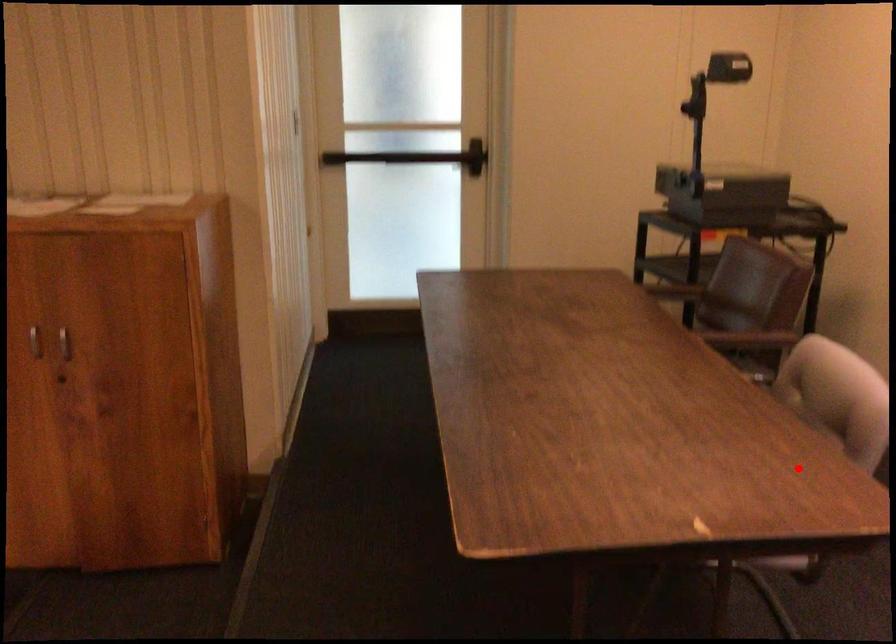
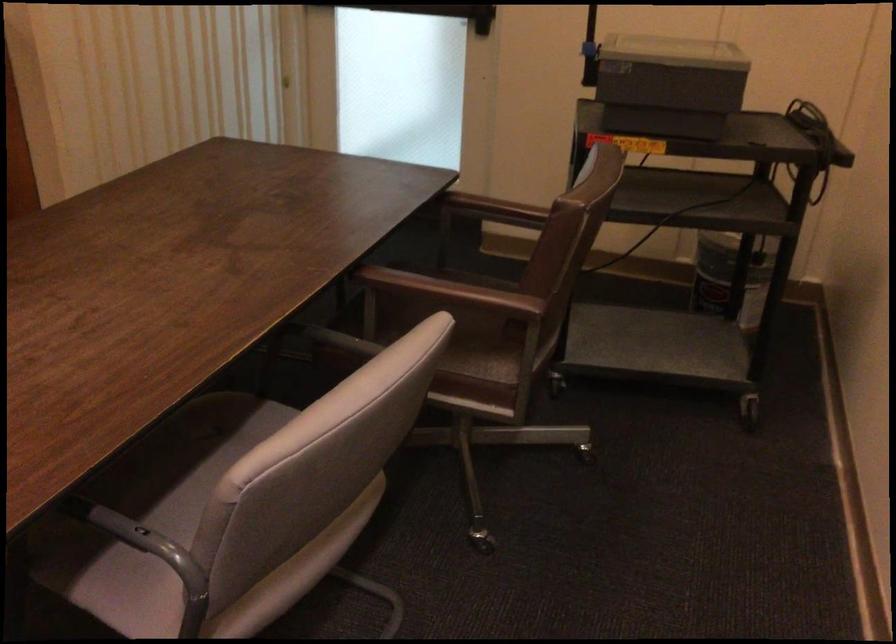
Question: I am providing you with two images of the same scene from different viewpoints. Image1 has a red point marked. In image2, the corresponding 3D location appears at what relative position? Reply with the corresponding letter.

Choices:
 (A) Closer
 (B) Farther

Answer: (A)